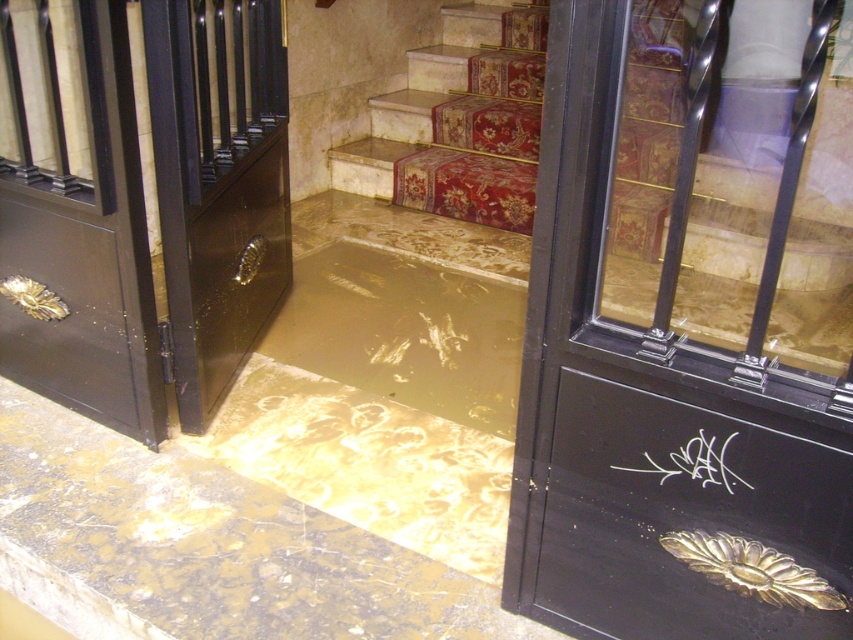
Question: Which point is farther to the camera?

Choices:
 (A) black glass door at center
 (B) red carpeted stairs at upper center
 (C) brown/muddy water at center

Answer: (B)

Question: Does brown/muddy water at center have a lesser width compared to red carpeted stairs at upper center?

Choices:
 (A) no
 (B) yes

Answer: (B)

Question: Is black glass door at center bigger than brown/muddy water at center?

Choices:
 (A) yes
 (B) no

Answer: (A)

Question: Which is nearer to the black glass door at center?

Choices:
 (A) red carpeted stairs at upper center
 (B) brown/muddy water at center

Answer: (A)

Question: Which of the following is the closest to the observer?

Choices:
 (A) brown/muddy water at center
 (B) red carpeted stairs at upper center

Answer: (A)

Question: Is black glass door at center closer to camera compared to red carpeted stairs at upper center?

Choices:
 (A) yes
 (B) no

Answer: (A)